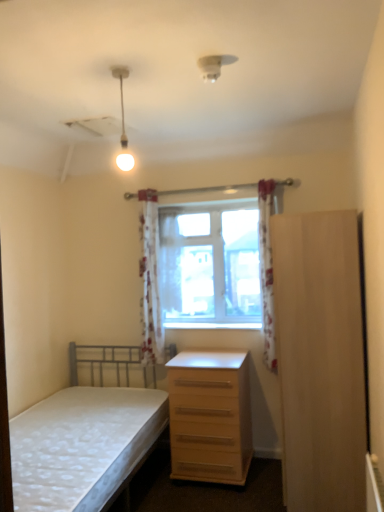
Question: Which direction should I rotate to face white floral fabric curtain at center, which is the 1th curtain in back-to-front order, — up or down?

Choices:
 (A) up
 (B) down

Answer: (B)

Question: From the image's perspective, is light wood/wooden chest of drawers at lower right over white fabric bed at lower left?

Choices:
 (A) yes
 (B) no

Answer: (A)

Question: Is light wood/wooden chest of drawers at lower right not close to white fabric bed at lower left?

Choices:
 (A) no
 (B) yes

Answer: (A)

Question: Considering the relative sizes of light wood/wooden chest of drawers at lower right and white fabric bed at lower left in the image provided, is light wood/wooden chest of drawers at lower right smaller than white fabric bed at lower left?

Choices:
 (A) no
 (B) yes

Answer: (B)

Question: Is light wood/wooden chest of drawers at lower right touching white fabric bed at lower left?

Choices:
 (A) no
 (B) yes

Answer: (A)

Question: Is light wood/wooden chest of drawers at lower right facing away from white fabric bed at lower left?

Choices:
 (A) yes
 (B) no

Answer: (B)

Question: From the image's perspective, is light wood/wooden chest of drawers at lower right under white fabric bed at lower left?

Choices:
 (A) no
 (B) yes

Answer: (A)

Question: From a real-world perspective, is light wood/wooden chest of drawers at lower right below light wood/file cabinet at right?

Choices:
 (A) no
 (B) yes

Answer: (B)

Question: Can you confirm if light wood/wooden chest of drawers at lower right is positioned to the left of light wood/file cabinet at right?

Choices:
 (A) no
 (B) yes

Answer: (B)

Question: Can you confirm if light wood/wooden chest of drawers at lower right is wider than light wood/file cabinet at right?

Choices:
 (A) yes
 (B) no

Answer: (A)

Question: Is light wood/wooden chest of drawers at lower right at the right side of light wood/file cabinet at right?

Choices:
 (A) no
 (B) yes

Answer: (A)

Question: Is light wood/wooden chest of drawers at lower right directly adjacent to light wood/file cabinet at right?

Choices:
 (A) yes
 (B) no

Answer: (B)

Question: Is light wood/file cabinet at right a part of light wood/wooden chest of drawers at lower right?

Choices:
 (A) yes
 (B) no

Answer: (B)

Question: Is the position of wooden at center less distant than that of white floral fabric curtain at center, marked as the 3th curtain in a front-to-back arrangement?

Choices:
 (A) yes
 (B) no

Answer: (A)